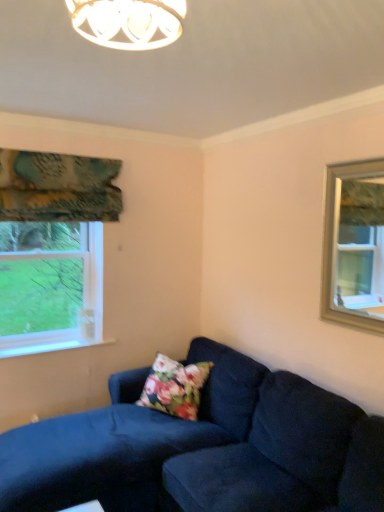
Question: Relative to suede dark blue couch at lower right, is floral fabric pillow at lower center in front or behind?

Choices:
 (A) behind
 (B) front

Answer: (A)

Question: Choose the correct answer: Is floral fabric pillow at lower center inside suede dark blue couch at lower right or outside it?

Choices:
 (A) outside
 (B) inside

Answer: (B)

Question: Estimate the real-world distances between objects in this image. Which object is closer to the floral fabric pillow at lower center?

Choices:
 (A) suede dark blue couch at lower right
 (B) clear glass window at upper right
 (C) teal floral fabric at upper left

Answer: (A)

Question: Which of these objects is positioned closest to the suede dark blue couch at lower right?

Choices:
 (A) floral fabric pillow at lower center
 (B) clear glass window at upper right
 (C) teal floral fabric at upper left

Answer: (A)